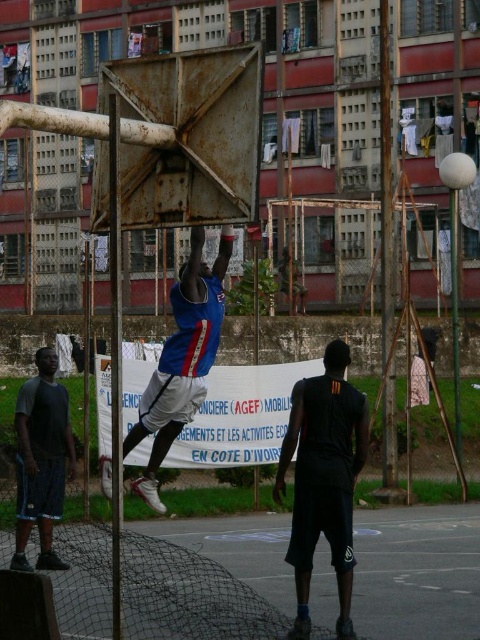
Does blue jersey at center have a lesser width compared to dark gray fabric shorts at lower left?

No, blue jersey at center is not thinner than dark gray fabric shorts at lower left.

Locate an element on the screen. This screenshot has width=480, height=640. blue jersey at center is located at coordinates (181, 358).

Where is `blue jersey at center`? This screenshot has width=480, height=640. blue jersey at center is located at coordinates (181, 358).

Based on the photo, who is more distant from viewer, (309, 531) or (190, 316)?

Positioned behind is point (190, 316).

I want to click on black matte shorts at lower right, so click(324, 480).

From the picture: Is black matte shorts at lower right wider than dark gray fabric shorts at lower left?

In fact, black matte shorts at lower right might be narrower than dark gray fabric shorts at lower left.

Can you confirm if black matte shorts at lower right is thinner than dark gray fabric shorts at lower left?

Yes, black matte shorts at lower right is thinner than dark gray fabric shorts at lower left.

What are the coordinates of `black matte shorts at lower right` in the screenshot? It's located at (324, 480).